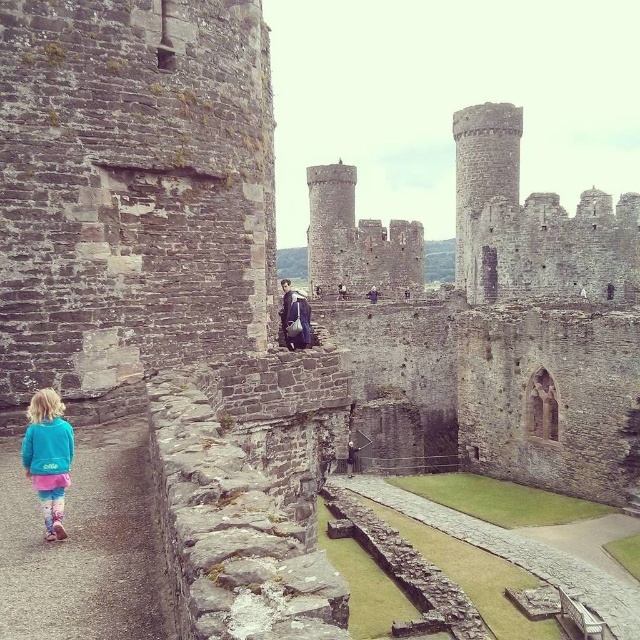
Can you confirm if turquoise fleece jacket at lower left is positioned to the left of dark blue jacket at center?

Correct, you'll find turquoise fleece jacket at lower left to the left of dark blue jacket at center.

Describe the element at coordinates (49, 456) in the screenshot. I see `turquoise fleece jacket at lower left` at that location.

Which is behind, point (61, 420) or point (339, 292)?

Positioned behind is point (339, 292).

You are a GUI agent. You are given a task and a screenshot of the screen. Output one action in this format:
    pyautogui.click(x=<x>, y=<y>)
    Task: Click on the turquoise fleece jacket at lower left
    
    Given the screenshot: What is the action you would take?
    pyautogui.click(x=49, y=456)

Who is positioned more to the left, brown stone castle at center or dark brown leather jacket at center?

dark brown leather jacket at center

Between brown stone castle at center and dark brown leather jacket at center, which one is positioned higher?

brown stone castle at center

Does point (620, 268) come behind point (289, 330)?

Yes, it is behind point (289, 330).

At what (x,y) coordinates should I click in order to perform the action: click on brown stone castle at center. Please return your answer as a coordinate pair (x, y). The width and height of the screenshot is (640, 640). Looking at the image, I should click on (522, 326).

Where is `brown stone castle at center`? brown stone castle at center is located at coordinates (522, 326).

Find the location of `brown stone castle at center`. brown stone castle at center is located at coordinates (522, 326).